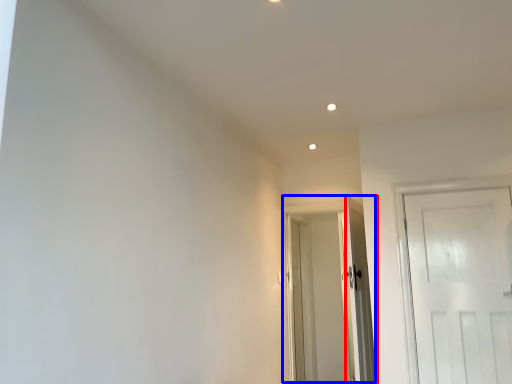
Question: Which object appears farthest to the camera in this image, door (highlighted by a red box) or door (highlighted by a blue box)?

Choices:
 (A) door
 (B) door

Answer: (B)